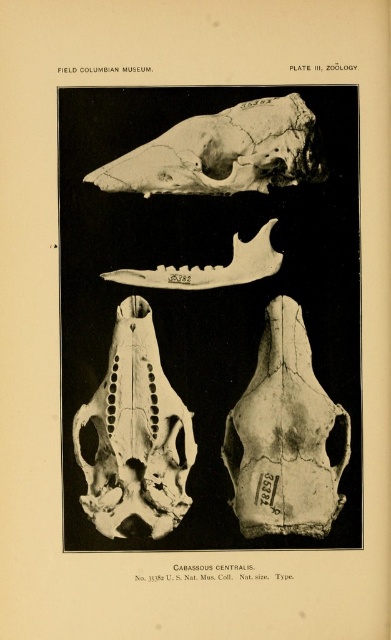
Based on the photo, between white bone skull at upper center and bone-like skull at center, which one has less height?

white bone skull at upper center

Is point (261, 260) positioned before point (312, 369)?

No, it is not.

Which is behind, point (184, 278) or point (303, 332)?

Positioned behind is point (184, 278).

Locate an element on the screen. This screenshot has width=391, height=640. white bone skull at upper center is located at coordinates (222, 152).

At what (x,y) coordinates should I click in order to perform the action: click on bone-like skull at center. Please return your answer as a coordinate pair (x, y). The width and height of the screenshot is (391, 640). Looking at the image, I should click on (285, 436).

Between bone-like skull at center and translucent bone skull at center, which one appears on the left side from the viewer's perspective?

Positioned to the left is translucent bone skull at center.

This screenshot has width=391, height=640. Describe the element at coordinates (285, 436) in the screenshot. I see `bone-like skull at center` at that location.

I want to click on bone-like skull at center, so click(285, 436).

Which is above, white bone skull at upper center or translucent bone skull at center?

white bone skull at upper center

Who is more distant from viewer, [181,125] or [157,472]?

The point [157,472] is behind.

Is point (261, 99) positioned after point (143, 314)?

That is False.

Where is `white bone skull at upper center`? This screenshot has height=640, width=391. white bone skull at upper center is located at coordinates (222, 152).